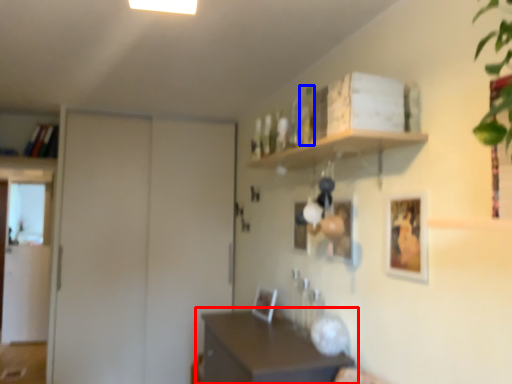
Question: Which point is closer to the camera, table (highlighted by a red box) or bottle (highlighted by a blue box)?

Choices:
 (A) table
 (B) bottle

Answer: (A)